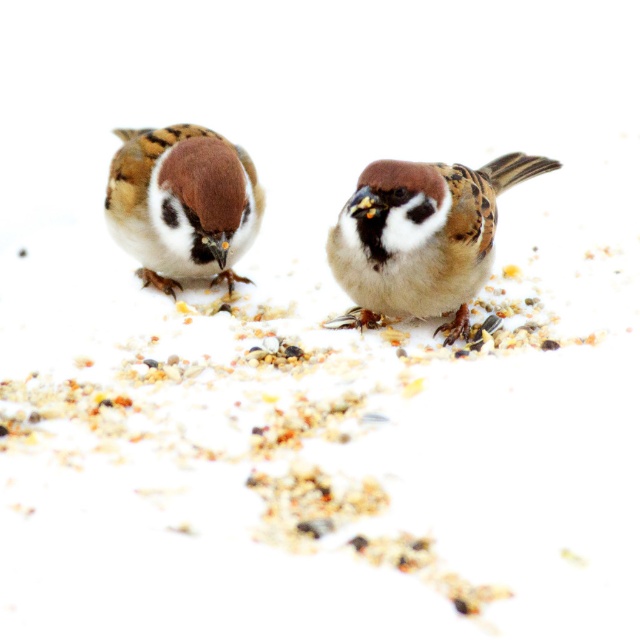
Based on the photo, is brown matte sparrow at center below brown matte sparrow at left?

Correct, brown matte sparrow at center is located below brown matte sparrow at left.

Is point (396, 264) positioned behind point (161, 150)?

No, it is not.

Is point (467, 324) positioned before point (161, 211)?

No, (467, 324) is behind (161, 211).

Locate an element on the screen. The image size is (640, 640). brown matte sparrow at center is located at coordinates (420, 236).